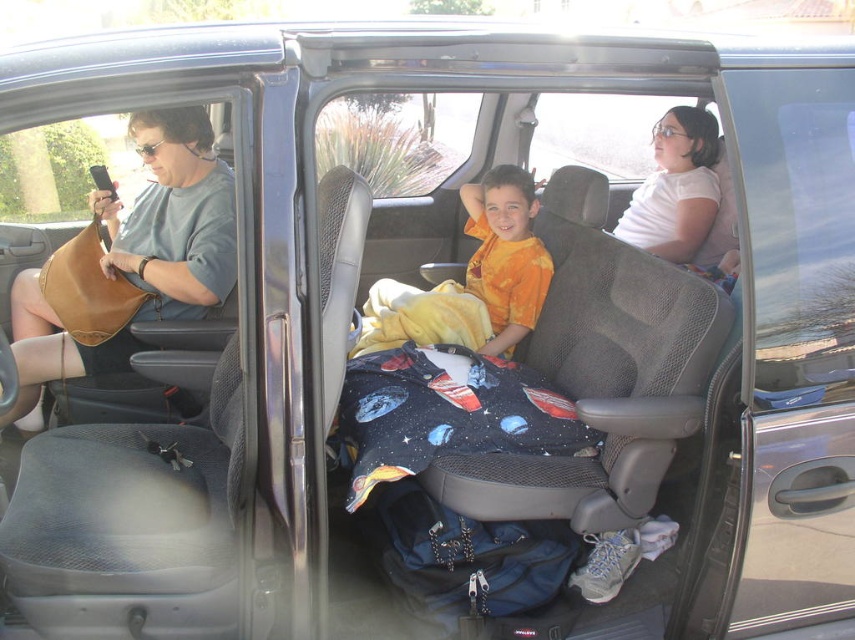
Question: Among these points, which one is farthest from the camera?

Choices:
 (A) (514, 337)
 (B) (34, 420)

Answer: (A)

Question: Which object is positioned farthest from the orange tie-dye shirt at center?

Choices:
 (A) leather handbag at left
 (B) orange cotton shirt at center

Answer: (A)

Question: Can you confirm if leather handbag at left is positioned above orange cotton shirt at center?

Choices:
 (A) no
 (B) yes

Answer: (A)

Question: Does leather handbag at left have a greater width compared to orange tie-dye shirt at center?

Choices:
 (A) yes
 (B) no

Answer: (A)

Question: Is orange cotton shirt at center to the right of orange tie-dye shirt at center from the viewer's perspective?

Choices:
 (A) no
 (B) yes

Answer: (A)

Question: Which of the following is the closest to the observer?

Choices:
 (A) (522, 326)
 (B) (115, 212)
 (C) (499, 172)

Answer: (B)